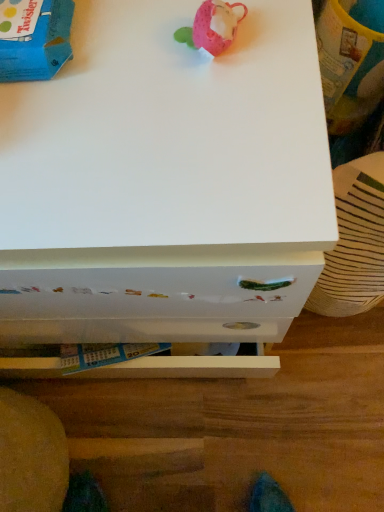
Question: Is white painted wood chest of drawers at center aimed at blue cardboard box at upper left, the 2th toy when ordered from right to left?

Choices:
 (A) no
 (B) yes

Answer: (A)

Question: Is white painted wood chest of drawers at center next to blue cardboard box at upper left, the 2th toy when ordered from right to left?

Choices:
 (A) yes
 (B) no

Answer: (B)

Question: From a real-world perspective, does white painted wood chest of drawers at center sit lower than blue cardboard box at upper left, the 2th toy when ordered from right to left?

Choices:
 (A) no
 (B) yes

Answer: (B)

Question: Does white painted wood chest of drawers at center lie behind blue cardboard box at upper left, the 2th toy when ordered from right to left?

Choices:
 (A) yes
 (B) no

Answer: (B)

Question: Considering the relative sizes of white painted wood chest of drawers at center and blue cardboard box at upper left, which is counted as the first toy, starting from the left, in the image provided, is white painted wood chest of drawers at center smaller than blue cardboard box at upper left, which is counted as the first toy, starting from the left,?

Choices:
 (A) no
 (B) yes

Answer: (A)

Question: Can you confirm if white painted wood chest of drawers at center is positioned to the left of blue cardboard box at upper left, which is counted as the first toy, starting from the left?

Choices:
 (A) yes
 (B) no

Answer: (A)

Question: From the image's perspective, does blue cardboard box at upper left, which is counted as the first toy, starting from the left, appear lower than white glossy drawer at lower center?

Choices:
 (A) no
 (B) yes

Answer: (A)

Question: Considering the relative positions of blue cardboard box at upper left, the 2th toy when ordered from right to left, and white glossy drawer at lower center in the image provided, is blue cardboard box at upper left, the 2th toy when ordered from right to left, behind white glossy drawer at lower center?

Choices:
 (A) yes
 (B) no

Answer: (B)

Question: From the image's perspective, is blue cardboard box at upper left, the 2th toy when ordered from right to left, over white glossy drawer at lower center?

Choices:
 (A) no
 (B) yes

Answer: (B)

Question: Considering the relative sizes of blue cardboard box at upper left, the 2th toy when ordered from right to left, and white glossy drawer at lower center in the image provided, is blue cardboard box at upper left, the 2th toy when ordered from right to left, smaller than white glossy drawer at lower center?

Choices:
 (A) no
 (B) yes

Answer: (B)

Question: Can you confirm if blue cardboard box at upper left, which is counted as the first toy, starting from the left, is bigger than white glossy drawer at lower center?

Choices:
 (A) yes
 (B) no

Answer: (B)

Question: Is blue cardboard box at upper left, which is counted as the first toy, starting from the left, at the right side of white glossy drawer at lower center?

Choices:
 (A) no
 (B) yes

Answer: (A)

Question: Is white glossy drawer at lower center not inside white painted wood chest of drawers at center?

Choices:
 (A) no
 (B) yes

Answer: (B)